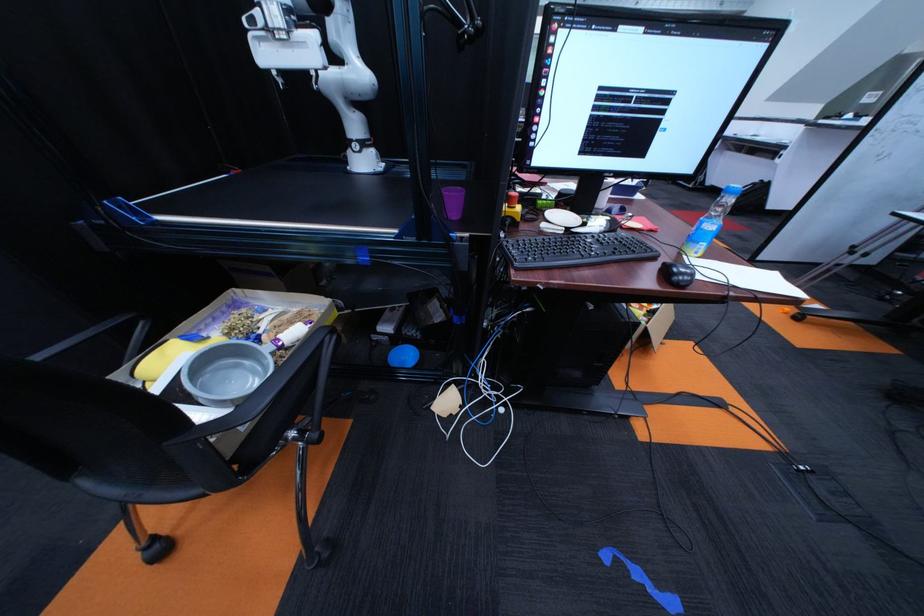
I want to click on grey bowl handle, so click(238, 385).